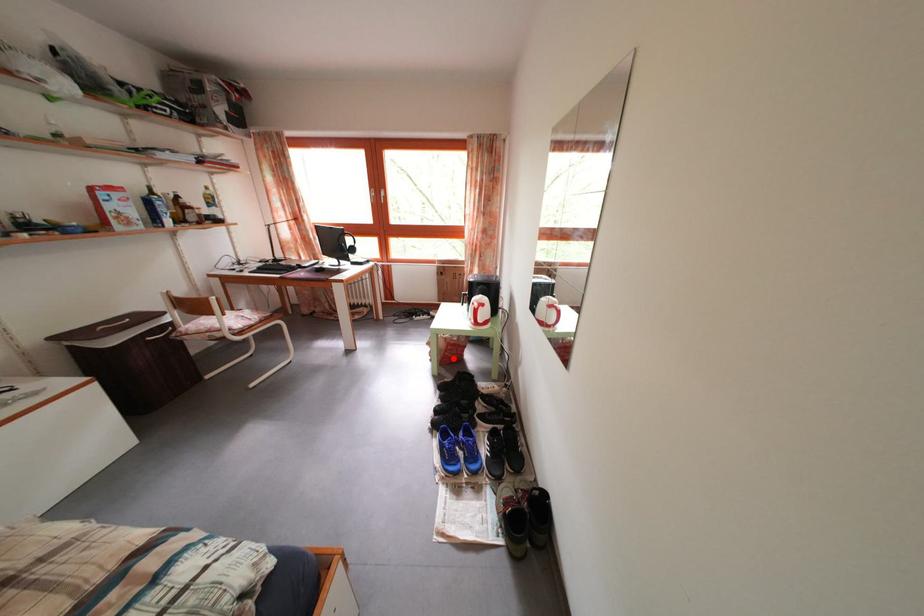
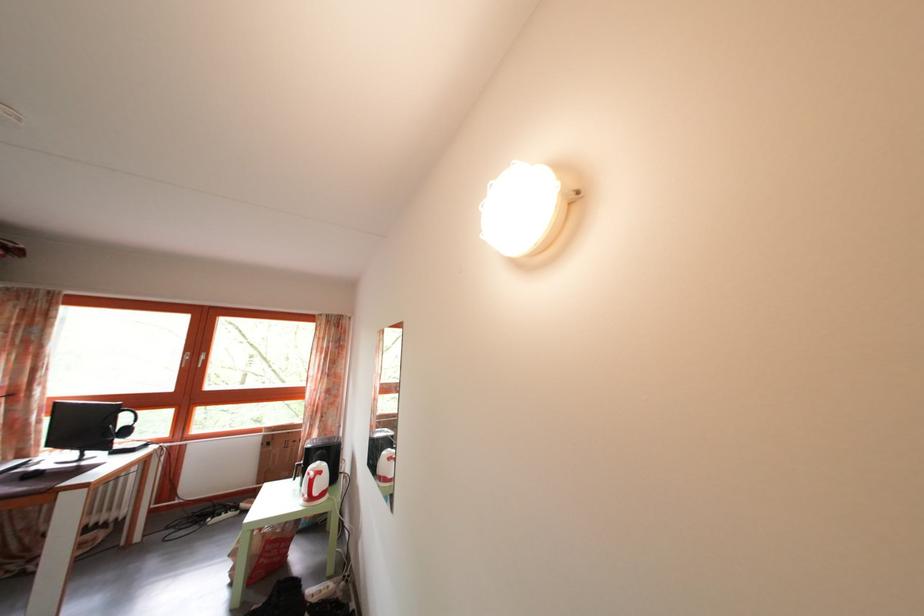
Question: I am providing you with two images of the same scene from different viewpoints. In image1, a red point is highlighted. Considering the same 3D point in image2, which of the following is correct?

Choices:
 (A) It is closer
 (B) It is farther

Answer: (A)